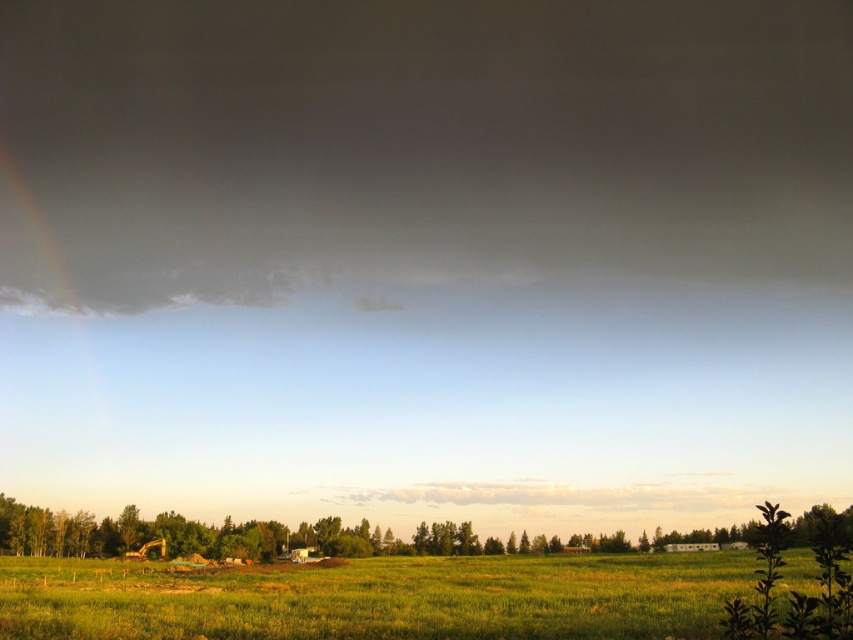
You are standing in the rural landscape and want to place a small flag at each of the two points, point [265,580] and point [662,541]. Which point is closer to you so that you can plant the flag first without moving?

Point [265,580] is closer to the viewer than point [662,541], so you can plant the flag at point [265,580] first without moving.

You are a landscape architect evaluating this rural area. You need to determine which object, the green grassy field at lower center or the green leafy tree at lower left, is taller. Based on the scene, which one is shorter?

The green grassy field at lower center is not as tall as the green leafy tree at lower left, so the green grassy field at lower center is shorter.

You are standing at the edge of the green grassy field at lower center and want to walk to the green leafy tree at lower left. Which direction should you face to walk directly towards the tree?

You should face towards the lower left direction to walk directly towards the green leafy tree at lower left from the green grassy field at lower center.